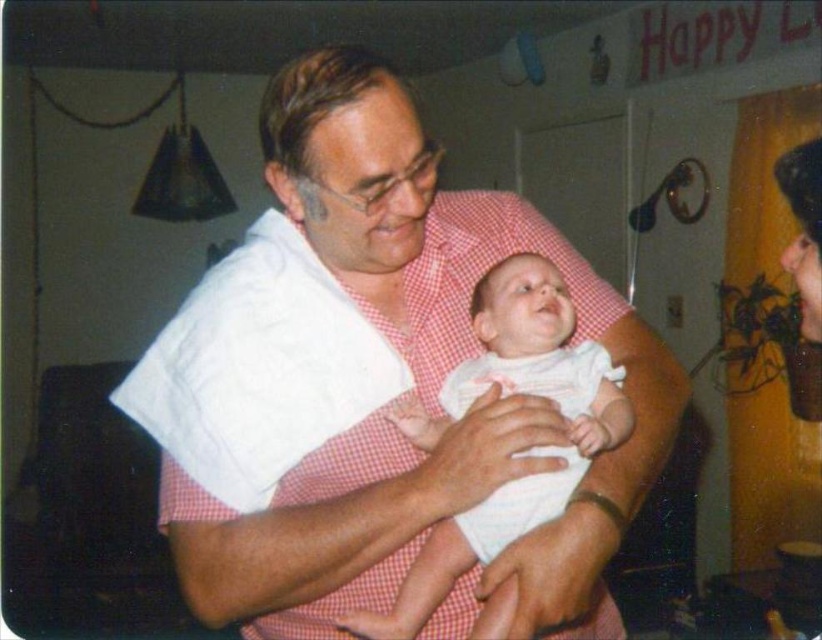
You are a photographer setting up for a family photo. You see the white cotton shirt at center and the white cotton baby at center. Which object is positioned to the left of the other?

The white cotton shirt at center is to the left of the white cotton baby at center.

You are a photographer adjusting the lighting in the scene. You need to ensure that the white cotton shirt at center and the white clothed arm at center are well lit. Given their distance apart, what is the minimum distance your lighting equipment must cover to illuminate both areas effectively?

The distance between the white cotton shirt at center and the white clothed arm at center is 3.98 inches, so the lighting equipment must cover at least 3.98 inches to ensure both areas are illuminated properly.